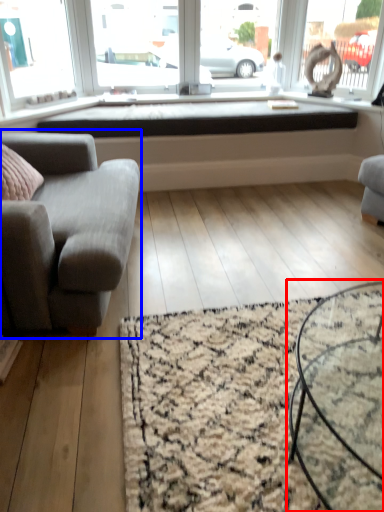
Question: Which object is closer to the camera taking this photo, coffee table (highlighted by a red box) or studio couch (highlighted by a blue box)?

Choices:
 (A) coffee table
 (B) studio couch

Answer: (A)